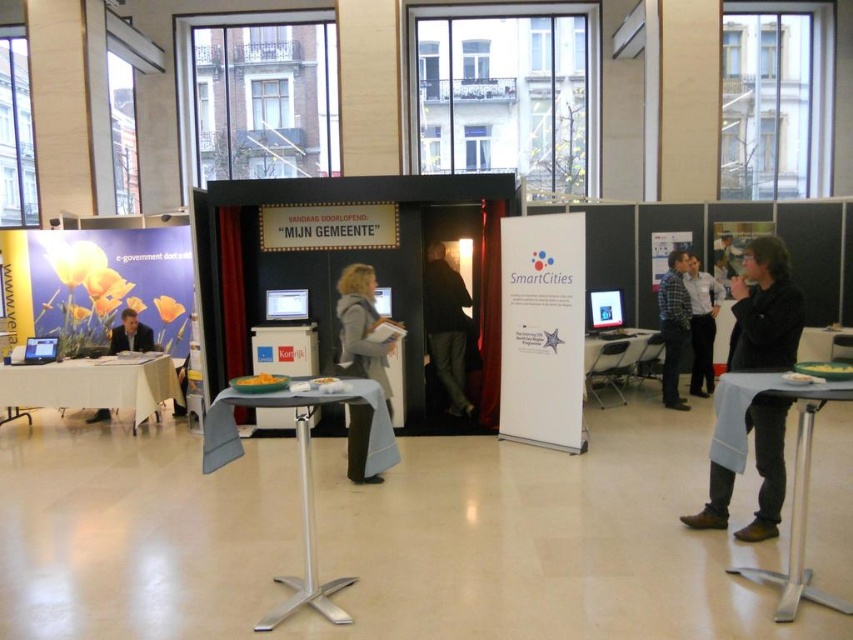
Based on the photo, does gray fabric table at center have a larger size compared to dark gray jacket at center?

Yes, gray fabric table at center is bigger than dark gray jacket at center.

Is gray fabric table at center behind dark gray jacket at center?

No, it is not.

Is point (265, 394) in front of point (460, 376)?

That is True.

Locate an element on the screen. gray fabric table at center is located at coordinates (300, 474).

Does point (718, 481) come behind point (795, 385)?

Yes, point (718, 481) is behind point (795, 385).

Can you confirm if dark gray sweater at right is thinner than metallic silver table at lower right?

Yes, dark gray sweater at right is thinner than metallic silver table at lower right.

Locate an element on the screen. The width and height of the screenshot is (853, 640). dark gray sweater at right is located at coordinates (764, 310).

Where is `dark gray sweater at right`? dark gray sweater at right is located at coordinates (764, 310).

Does matte black computer at center appear over matte black laptop at left?

Indeed, matte black computer at center is positioned over matte black laptop at left.

Does point (306, 301) come in front of point (49, 346)?

Yes, it is in front of point (49, 346).

You are a GUI agent. You are given a task and a screenshot of the screen. Output one action in this format:
    pyautogui.click(x=<x>, y=<y>)
    Task: Click on the matte black computer at center
    The image size is (853, 640).
    Given the screenshot: What is the action you would take?
    pyautogui.click(x=286, y=305)